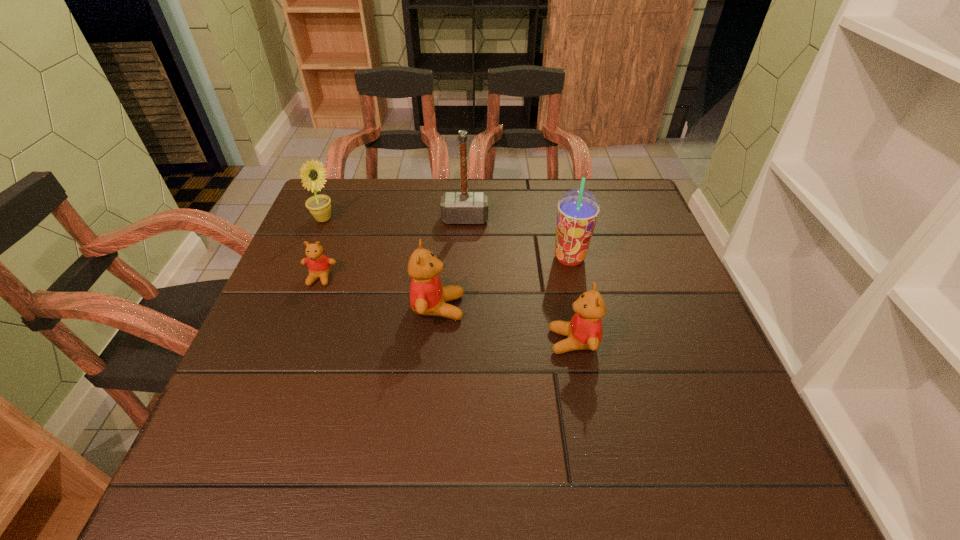
At what (x,y) coordinates should I click in order to perform the action: click on object at the far left corner. Please return your answer as a coordinate pair (x, y). The image size is (960, 540). Looking at the image, I should click on (312, 173).

The image size is (960, 540). I want to click on free space at the far edge of the desktop, so click(x=441, y=185).

The height and width of the screenshot is (540, 960). I want to click on free space at the near edge, so click(x=502, y=417).

In the image, there is a desktop. Find the location of `vacant space at the left edge`. vacant space at the left edge is located at coordinates (274, 330).

The height and width of the screenshot is (540, 960). What are the coordinates of `free space at the right edge` in the screenshot? It's located at (663, 325).

Find the location of a particular element. The height and width of the screenshot is (540, 960). free space at the far left corner of the desktop is located at coordinates [310, 212].

Find the location of a particular element. vacant space at the near left corner of the desktop is located at coordinates (224, 423).

In the image, there is a desktop. Identify the location of vacant space at the far right corner. (640, 219).

I want to click on vacant space at the near right corner of the desktop, so click(664, 423).

This screenshot has height=540, width=960. Identify the location of empty space between the second shortest teddy bear and the sunflower. (448, 280).